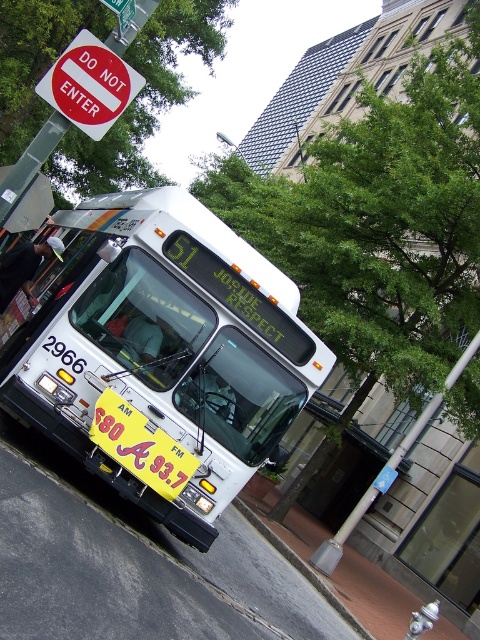
Which is more to the right, white metallic bus at center or yellow fabric sign at lower left?

From the viewer's perspective, yellow fabric sign at lower left appears more on the right side.

Is white metallic bus at center positioned in front of yellow fabric sign at lower left?

No, it is not.

Who is more forward, (68, 337) or (164, 440)?

Point (164, 440) is more forward.

Where is `white metallic bus at center`? This screenshot has height=640, width=480. white metallic bus at center is located at coordinates (164, 355).

Looking at this image, is green leafy tree at upper center thinner than red plastic sign at upper left?

No, green leafy tree at upper center is not thinner than red plastic sign at upper left.

Does point (134, 56) come farther from viewer compared to point (87, 49)?

Yes, it is behind point (87, 49).

Locate an element on the screen. green leafy tree at upper center is located at coordinates (144, 93).

Can you confirm if white metallic bus at center is bigger than green leafy tree at center?

Incorrect, white metallic bus at center is not larger than green leafy tree at center.

Which is below, white metallic bus at center or green leafy tree at center?

white metallic bus at center is below.

Locate an element on the screen. white metallic bus at center is located at coordinates (164, 355).